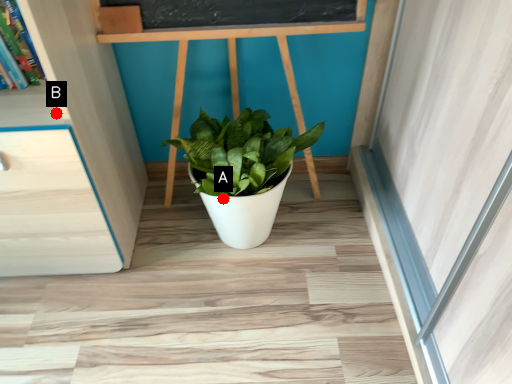
Question: Two points are circled on the image, labeled by A and B beside each circle. Which point is closer to the camera?

Choices:
 (A) A is closer
 (B) B is closer

Answer: (B)